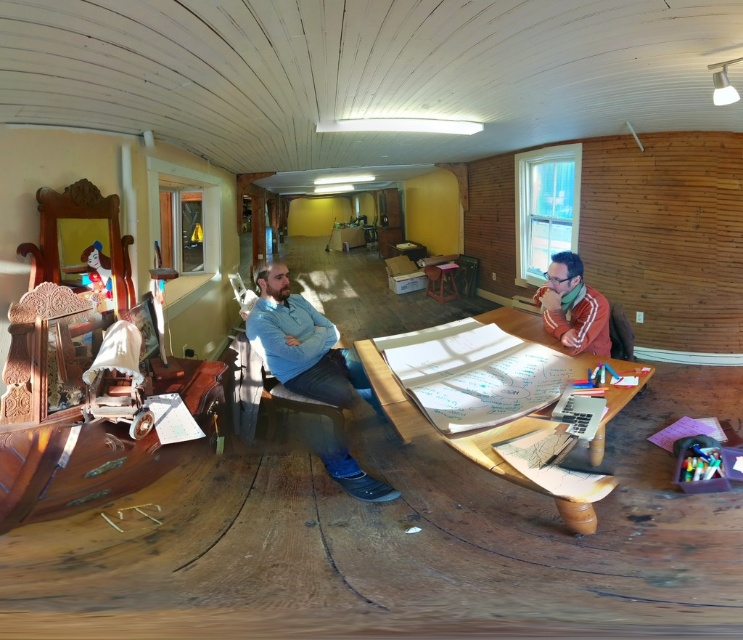
Does blue jeans at center appear over reddish-brown leather jacket at right?

Incorrect, blue jeans at center is not positioned above reddish-brown leather jacket at right.

Looking at this image, is blue jeans at center wider than reddish-brown leather jacket at right?

Correct, the width of blue jeans at center exceeds that of reddish-brown leather jacket at right.

Does point (270, 332) lie in front of point (591, 314)?

No, (270, 332) is behind (591, 314).

Find the location of `blue jeans at center`. blue jeans at center is located at coordinates (302, 344).